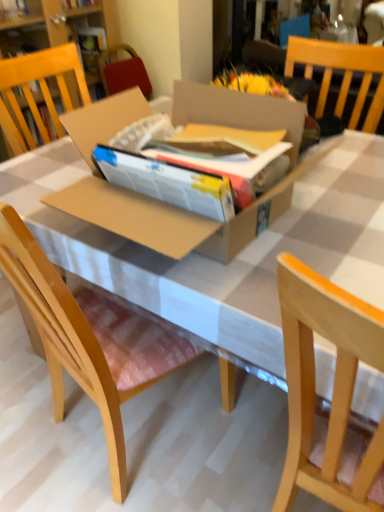
Describe the element at coordinates (160, 202) in the screenshot. I see `brown cardboard box at center` at that location.

The height and width of the screenshot is (512, 384). I want to click on wooden chair at center, which is the 2th chair in right-to-left order, so click(x=90, y=338).

At what (x,y) coordinates should I click in order to perform the action: click on brown cardboard box at center. Please return your answer as a coordinate pair (x, y). Looking at the image, I should click on (218, 262).

Which object is more forward, wooden chair at center, which is the 2th chair in right-to-left order, or brown cardboard box at center?

wooden chair at center, which is the 2th chair in right-to-left order, is in front.

Is wooden chair at center, which is the 2th chair in right-to-left order, oriented towards brown cardboard box at center?

Yes, wooden chair at center, which is the 2th chair in right-to-left order, is turned towards brown cardboard box at center.

Considering the positions of objects wooden chair at center, which is the 2th chair in right-to-left order, and brown cardboard box at center in the image provided, who is more to the left, wooden chair at center, which is the 2th chair in right-to-left order, or brown cardboard box at center?

Positioned to the left is wooden chair at center, which is the 2th chair in right-to-left order.

From the image's perspective, which is below, wooden chair at center, which ranks as the first chair in left-to-right order, or brown cardboard box at center?

wooden chair at center, which ranks as the first chair in left-to-right order.

From their relative heights in the image, would you say light wood chair at right, acting as the 1th chair starting from the right, is taller or shorter than brown cardboard box at center?

In the image, light wood chair at right, acting as the 1th chair starting from the right, appears to be taller than brown cardboard box at center.

Is light wood chair at right, the 2th chair from the left, to the left or to the right of brown cardboard box at center in the image?

light wood chair at right, the 2th chair from the left, is to the right of brown cardboard box at center.

Find the location of `chair located on the right of brown cardboard box at center`. chair located on the right of brown cardboard box at center is located at coordinates (333, 393).

Relative to brown cardboard box at center, is light wood chair at right, the 2th chair from the left, in front or behind?

light wood chair at right, the 2th chair from the left, is positioned closer to the viewer than brown cardboard box at center.

From the image's perspective, count 2nd chairs downward from the brown cardboard box at center and point to it. Please provide its 2D coordinates.

[(333, 393)]

Which is in front, brown cardboard box at center or light wood chair at right, the 2th chair from the left?

light wood chair at right, the 2th chair from the left, is in front.

Could you tell me if brown cardboard box at center is facing light wood chair at right, the 2th chair from the left?

Yes.

From a real-world perspective, relative to light wood chair at right, acting as the 1th chair starting from the right, is brown cardboard box at center vertically above or below?

Clearly, from a real-world perspective, brown cardboard box at center is below light wood chair at right, acting as the 1th chair starting from the right.

Considering the sizes of objects light wood chair at right, the 2th chair from the left, and wooden chair at center, which is the 2th chair in right-to-left order, in the image provided, who is wider, light wood chair at right, the 2th chair from the left, or wooden chair at center, which is the 2th chair in right-to-left order,?

Wider between the two is light wood chair at right, the 2th chair from the left.

Considering the relative sizes of light wood chair at right, the 2th chair from the left, and wooden chair at center, which is the 2th chair in right-to-left order, in the image provided, is light wood chair at right, the 2th chair from the left, shorter than wooden chair at center, which is the 2th chair in right-to-left order,?

No, light wood chair at right, the 2th chair from the left, is not shorter than wooden chair at center, which is the 2th chair in right-to-left order.

Is light wood chair at right, the 2th chair from the left, completely or partially outside of wooden chair at center, which is the 2th chair in right-to-left order?

Yes, light wood chair at right, the 2th chair from the left, is located beyond the bounds of wooden chair at center, which is the 2th chair in right-to-left order.

Is point (345, 328) closer or farther from the camera than point (29, 290)?

Point (345, 328) appears to be closer to the viewer than point (29, 290).

Would you say brown cardboard box at center is a long distance from wooden chair at center, which ranks as the first chair in left-to-right order?

That's not correct — brown cardboard box at center is a little close to wooden chair at center, which ranks as the first chair in left-to-right order.

Measure the distance between brown cardboard box at center and wooden chair at center, which ranks as the first chair in left-to-right order.

11.87 inches.

Who is more distant, brown cardboard box at center or wooden chair at center, which ranks as the first chair in left-to-right order?

Positioned behind is brown cardboard box at center.

Can you confirm if brown cardboard box at center is positioned to the left of wooden chair at center, which ranks as the first chair in left-to-right order?

A: In fact, brown cardboard box at center is to the right of wooden chair at center, which ranks as the first chair in left-to-right order.

How distant is brown cardboard box at center from light wood chair at right, acting as the 1th chair starting from the right?

brown cardboard box at center is 49.24 centimeters from light wood chair at right, acting as the 1th chair starting from the right.

Between brown cardboard box at center and light wood chair at right, the 2th chair from the left, which one has larger width?

Wider between the two is brown cardboard box at center.

Is brown cardboard box at center inside or outside of light wood chair at right, acting as the 1th chair starting from the right?

brown cardboard box at center is not enclosed by light wood chair at right, acting as the 1th chair starting from the right.

Between brown cardboard box at center and light wood chair at right, acting as the 1th chair starting from the right, which one appears on the left side from the viewer's perspective?

From the viewer's perspective, brown cardboard box at center appears more on the left side.

From the picture: From a real-world perspective, is brown cardboard box at center positioned over brown cardboard box at center based on gravity?

Yes, from a real-world perspective, brown cardboard box at center is on top of brown cardboard box at center.

Is point (189, 221) in front of point (298, 207)?

Yes.

Is brown cardboard box at center not near brown cardboard box at center?

No, brown cardboard box at center is not far away from brown cardboard box at center.

Where is `the 2nd chair directly beneath the brown cardboard box at center (from a real-world perspective)`? The width and height of the screenshot is (384, 512). the 2nd chair directly beneath the brown cardboard box at center (from a real-world perspective) is located at coordinates (90, 338).

I want to click on cardboard box above the light wood chair at right, the 2th chair from the left (from the image's perspective), so click(x=160, y=202).

Considering their positions, is light wood chair at right, acting as the 1th chair starting from the right, positioned closer to brown cardboard box at center than wooden chair at center, which ranks as the first chair in left-to-right order?

wooden chair at center, which ranks as the first chair in left-to-right order, is closer to brown cardboard box at center.

Considering their positions, is light wood chair at right, the 2th chair from the left, positioned further to brown cardboard box at center than wooden chair at center, which is the 2th chair in right-to-left order?

Based on the image, light wood chair at right, the 2th chair from the left, appears to be further to brown cardboard box at center.

Which object lies nearer to the anchor point wooden chair at center, which is the 2th chair in right-to-left order, light wood chair at right, the 2th chair from the left, or brown cardboard box at center?

The object closer to wooden chair at center, which is the 2th chair in right-to-left order, is brown cardboard box at center.

Based on their spatial positions, is brown cardboard box at center or brown cardboard box at center further from light wood chair at right, acting as the 1th chair starting from the right?

Based on the image, brown cardboard box at center appears to be further to light wood chair at right, acting as the 1th chair starting from the right.

Considering their positions, is brown cardboard box at center positioned further to light wood chair at right, acting as the 1th chair starting from the right, than wooden chair at center, which ranks as the first chair in left-to-right order?

Based on the image, brown cardboard box at center appears to be further to light wood chair at right, acting as the 1th chair starting from the right.

In the scene shown: Looking at the image, which one is located closer to brown cardboard box at center, brown cardboard box at center or light wood chair at right, the 2th chair from the left?

The object closer to brown cardboard box at center is brown cardboard box at center.

Considering their positions, is brown cardboard box at center positioned further to wooden chair at center, which ranks as the first chair in left-to-right order, than brown cardboard box at center?

brown cardboard box at center lies further to wooden chair at center, which ranks as the first chair in left-to-right order, than the other object.

Considering their positions, is light wood chair at right, acting as the 1th chair starting from the right, positioned further to wooden chair at center, which is the 2th chair in right-to-left order, than brown cardboard box at center?

light wood chair at right, acting as the 1th chair starting from the right, is positioned further to the anchor wooden chair at center, which is the 2th chair in right-to-left order.

Where is `cardboard box situated between wooden chair at center, which is the 2th chair in right-to-left order, and brown cardboard box at center from left to right`? This screenshot has height=512, width=384. cardboard box situated between wooden chair at center, which is the 2th chair in right-to-left order, and brown cardboard box at center from left to right is located at coordinates (160, 202).

Find the location of a particular element. Image resolution: width=384 pixels, height=512 pixels. desk that lies between brown cardboard box at center and light wood chair at right, the 2th chair from the left, from top to bottom is located at coordinates (218, 262).

Where is `cardboard box situated between wooden chair at center, which ranks as the first chair in left-to-right order, and light wood chair at right, acting as the 1th chair starting from the right, from left to right`? The width and height of the screenshot is (384, 512). cardboard box situated between wooden chair at center, which ranks as the first chair in left-to-right order, and light wood chair at right, acting as the 1th chair starting from the right, from left to right is located at coordinates (160, 202).

Locate an element on the screen. This screenshot has height=512, width=384. desk between wooden chair at center, which ranks as the first chair in left-to-right order, and light wood chair at right, acting as the 1th chair starting from the right, from left to right is located at coordinates (218, 262).